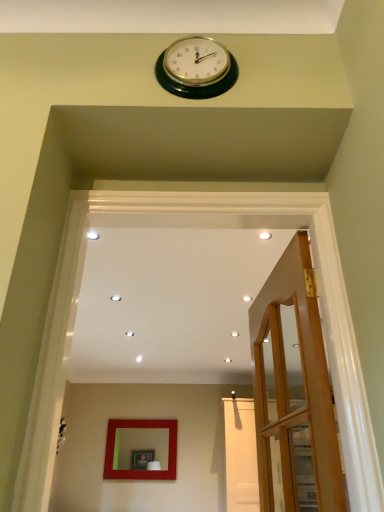
You are a GUI agent. You are given a task and a screenshot of the screen. Output one action in this format:
    pyautogui.click(x=<x>, y=<y>)
    Task: Click on the wooden door at right
    This screenshot has width=384, height=512.
    Given the screenshot: What is the action you would take?
    pyautogui.click(x=295, y=391)

Image resolution: width=384 pixels, height=512 pixels. What do you see at coordinates (295, 391) in the screenshot?
I see `wooden door at right` at bounding box center [295, 391].

This screenshot has height=512, width=384. Describe the element at coordinates (140, 445) in the screenshot. I see `matte red mirror at center` at that location.

Locate an element on the screen. Image resolution: width=384 pixels, height=512 pixels. matte red mirror at center is located at coordinates (140, 445).

You are a GUI agent. You are given a task and a screenshot of the screen. Output one action in this format:
    pyautogui.click(x=<x>, y=<y>)
    Task: Click on the wooden door at right
    The image size is (384, 512).
    Given the screenshot: What is the action you would take?
    pyautogui.click(x=295, y=391)

Which is more to the right, wooden door at right or matte red mirror at center?

From the viewer's perspective, wooden door at right appears more on the right side.

Consider the image. Is wooden door at right in front of or behind matte red mirror at center in the image?

In the image, wooden door at right appears in front of matte red mirror at center.

Considering the positions of points (321, 441) and (155, 435), is point (321, 441) closer to camera compared to point (155, 435)?

Yes, it is.

From the image's perspective, is wooden door at right below matte red mirror at center?

No.

From a real-world perspective, is wooden door at right positioned over matte red mirror at center based on gravity?

No, from a real-world perspective, wooden door at right is not on top of matte red mirror at center.

Considering the relative sizes of wooden door at right and matte red mirror at center in the image provided, is wooden door at right thinner than matte red mirror at center?

Incorrect, the width of wooden door at right is not less than that of matte red mirror at center.

Is wooden door at right shorter than matte red mirror at center?

No.

Considering the sizes of objects wooden door at right and matte red mirror at center in the image provided, who is bigger, wooden door at right or matte red mirror at center?

With larger size is wooden door at right.

Is wooden door at right not inside matte red mirror at center?

That's correct, wooden door at right is outside of matte red mirror at center.

Is the surface of wooden door at right in direct contact with matte red mirror at center?

No, wooden door at right is not in contact with matte red mirror at center.

Could you tell me if wooden door at right is facing matte red mirror at center?

No, wooden door at right is not turned towards matte red mirror at center.

You are a GUI agent. You are given a task and a screenshot of the screen. Output one action in this format:
    pyautogui.click(x=<x>, y=<y>)
    Task: Click on the mirror on the left of wooden door at right
    The height and width of the screenshot is (512, 384).
    Given the screenshot: What is the action you would take?
    pyautogui.click(x=140, y=445)

Considering the positions of objects matte red mirror at center and wooden door at right in the image provided, who is more to the right, matte red mirror at center or wooden door at right?

From the viewer's perspective, wooden door at right appears more on the right side.

Considering their positions, is matte red mirror at center located in front of or behind wooden door at right?

In the image, matte red mirror at center appears behind wooden door at right.

Between point (131, 443) and point (285, 451), which one is positioned behind?

The point (131, 443) is behind.

From the image's perspective, who appears lower, matte red mirror at center or wooden door at right?

matte red mirror at center is shown below in the image.

From a real-world perspective, is matte red mirror at center above or below wooden door at right?

matte red mirror at center is above wooden door at right.

Which object is wider, matte red mirror at center or wooden door at right?

wooden door at right.

Between matte red mirror at center and wooden door at right, which one has less height?

matte red mirror at center.

Does matte red mirror at center have a smaller size compared to wooden door at right?

Yes, matte red mirror at center is smaller than wooden door at right.

Looking at this image, is matte red mirror at center inside the boundaries of wooden door at right, or outside?

matte red mirror at center is not inside wooden door at right, it's outside.

Are matte red mirror at center and wooden door at right far apart?

Yes, matte red mirror at center is far from wooden door at right.

Does matte red mirror at center turn towards wooden door at right?

Yes, matte red mirror at center is aimed at wooden door at right.

How different are the orientations of matte red mirror at center and wooden door at right in degrees?

85 degrees.

Where is `door that appears above the matte red mirror at center (from the image's perspective)`? door that appears above the matte red mirror at center (from the image's perspective) is located at coordinates (295, 391).

The height and width of the screenshot is (512, 384). I want to click on mirror below the wooden door at right (from the image's perspective), so click(140, 445).

Identify the location of door on the right side of matte red mirror at center. The height and width of the screenshot is (512, 384). (295, 391).